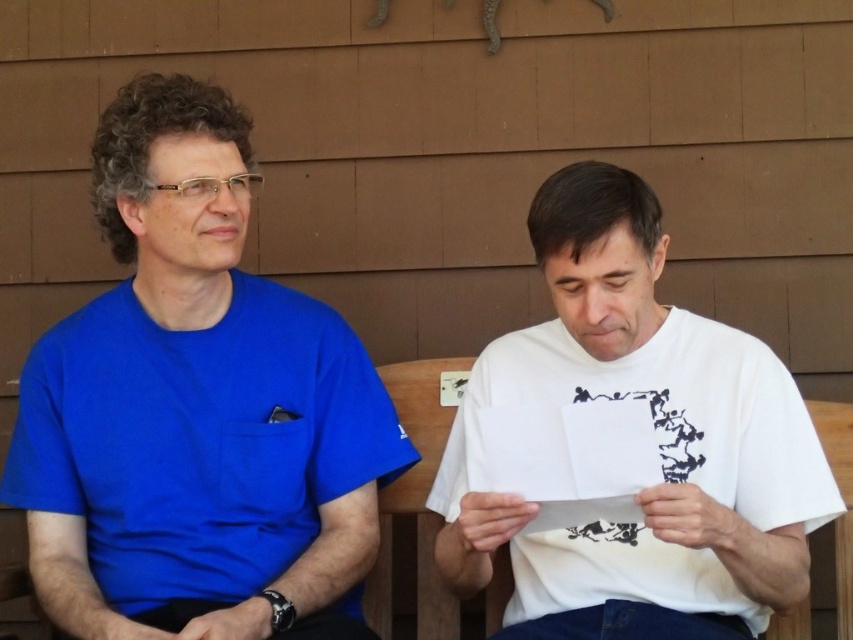
Question: Which of the following is the closest to the observer?

Choices:
 (A) (646, 321)
 (B) (405, 454)

Answer: (A)

Question: Does blue smooth t-shirt at left lie in front of white matte paper at center?

Choices:
 (A) yes
 (B) no

Answer: (B)

Question: Which point is closer to the camera taking this photo?

Choices:
 (A) (132, 486)
 (B) (602, 214)

Answer: (B)

Question: Which point is closer to the camera taking this photo?

Choices:
 (A) [x=212, y=609]
 (B) [x=729, y=618]

Answer: (B)

Question: Does blue smooth t-shirt at left appear under white matte paper at center?

Choices:
 (A) no
 (B) yes

Answer: (A)

Question: Is blue smooth t-shirt at left above white matte paper at center?

Choices:
 (A) yes
 (B) no

Answer: (A)